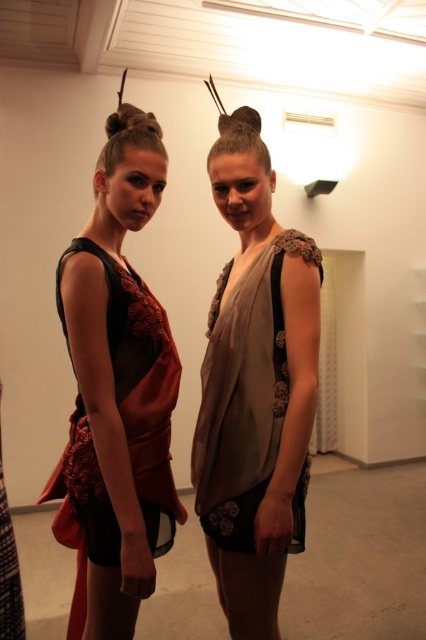
Is point (121, 340) positioned behind point (270, 468)?

That is False.

Between point (134, 592) and point (238, 289), which one is positioned in front?

Positioned in front is point (134, 592).

Who is more distant from viewer, (135, 438) or (276, 406)?

Positioned behind is point (276, 406).

Locate an element on the screen. The image size is (426, 640). matte red fabric dress at center is located at coordinates (117, 394).